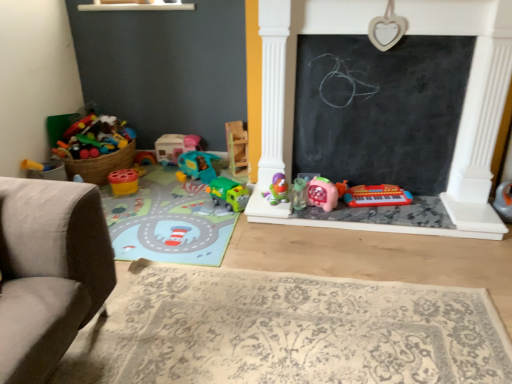
Where is `free space to the back side of matte plastic cup at center-left, which is the first toy in left-to-right order`? free space to the back side of matte plastic cup at center-left, which is the first toy in left-to-right order is located at coordinates pos(150,174).